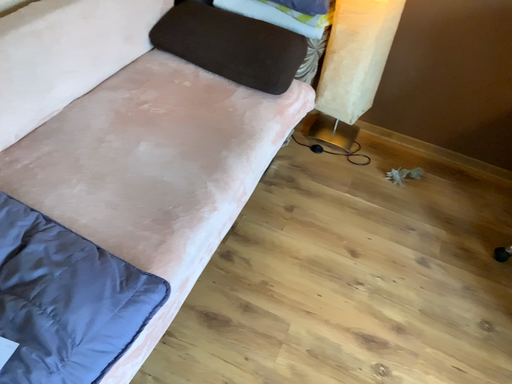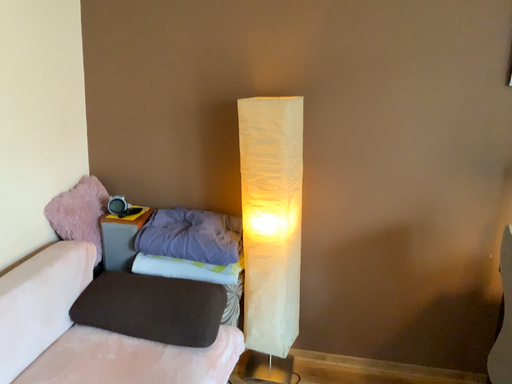
Question: Which way did the camera rotate in the video?

Choices:
 (A) rotated downward
 (B) rotated upward

Answer: (B)